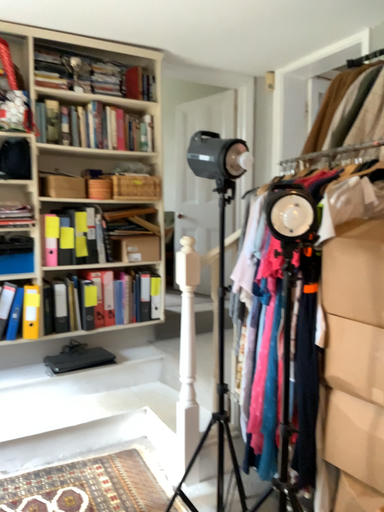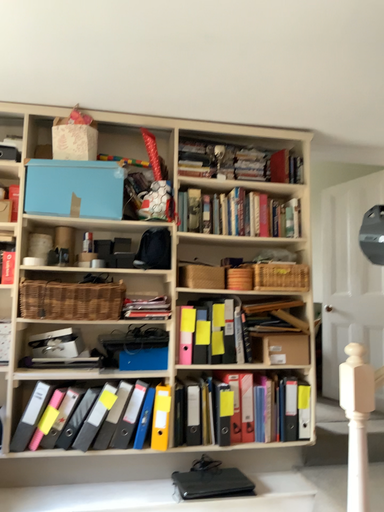
Question: How did the camera likely rotate when shooting the video?

Choices:
 (A) rotated left
 (B) rotated right

Answer: (A)